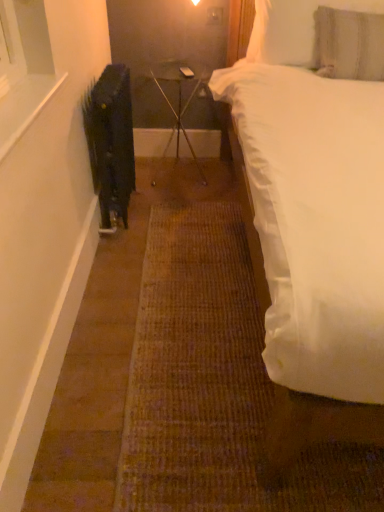
Question: From a real-world perspective, is textured gray pillow at upper right, which is the first pillow in bottom-to-top order, positioned over clear glass table at center based on gravity?

Choices:
 (A) no
 (B) yes

Answer: (B)

Question: Does textured gray pillow at upper right, the 2th pillow when ordered from top to bottom, appear on the right side of clear glass table at center?

Choices:
 (A) yes
 (B) no

Answer: (A)

Question: Is textured gray pillow at upper right, the 2th pillow when ordered from top to bottom, thinner than clear glass table at center?

Choices:
 (A) no
 (B) yes

Answer: (B)

Question: Does textured gray pillow at upper right, the 2th pillow when ordered from top to bottom, appear on the left side of clear glass table at center?

Choices:
 (A) yes
 (B) no

Answer: (B)

Question: Is textured gray pillow at upper right, which is the first pillow in bottom-to-top order, taller than clear glass table at center?

Choices:
 (A) yes
 (B) no

Answer: (B)

Question: Considering the relative sizes of textured gray pillow at upper right, the 2th pillow when ordered from top to bottom, and clear glass table at center in the image provided, is textured gray pillow at upper right, the 2th pillow when ordered from top to bottom, wider than clear glass table at center?

Choices:
 (A) no
 (B) yes

Answer: (A)

Question: Considering the relative sizes of textured gray pillow at upper right, the 2th pillow when ordered from top to bottom, and black matte radiator at left in the image provided, is textured gray pillow at upper right, the 2th pillow when ordered from top to bottom, bigger than black matte radiator at left?

Choices:
 (A) no
 (B) yes

Answer: (B)

Question: Can you confirm if textured gray pillow at upper right, which is the first pillow in bottom-to-top order, is positioned to the left of black matte radiator at left?

Choices:
 (A) no
 (B) yes

Answer: (A)

Question: Is textured gray pillow at upper right, which is the first pillow in bottom-to-top order, not close to black matte radiator at left?

Choices:
 (A) yes
 (B) no

Answer: (A)

Question: Is textured gray pillow at upper right, which is the first pillow in bottom-to-top order, behind black matte radiator at left?

Choices:
 (A) yes
 (B) no

Answer: (A)

Question: Is textured gray pillow at upper right, the 2th pillow when ordered from top to bottom, positioned before black matte radiator at left?

Choices:
 (A) no
 (B) yes

Answer: (A)

Question: From the image's perspective, does textured gray pillow at upper right, which is the first pillow in bottom-to-top order, appear higher than black matte radiator at left?

Choices:
 (A) no
 (B) yes

Answer: (B)

Question: Can you confirm if white soft pillow at upper right, the 2th pillow positioned from the bottom, is taller than black matte radiator at left?

Choices:
 (A) yes
 (B) no

Answer: (B)